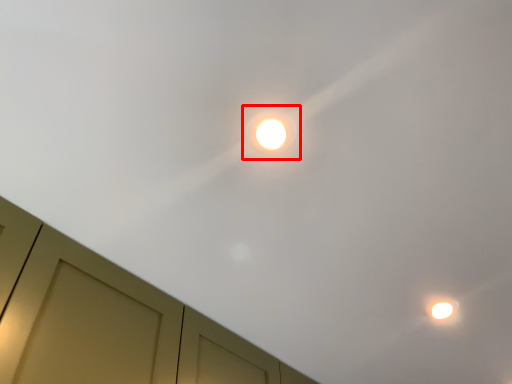
Question: In this image, where is droplight (annotated by the red box) located relative to dresser?

Choices:
 (A) right
 (B) left

Answer: (A)